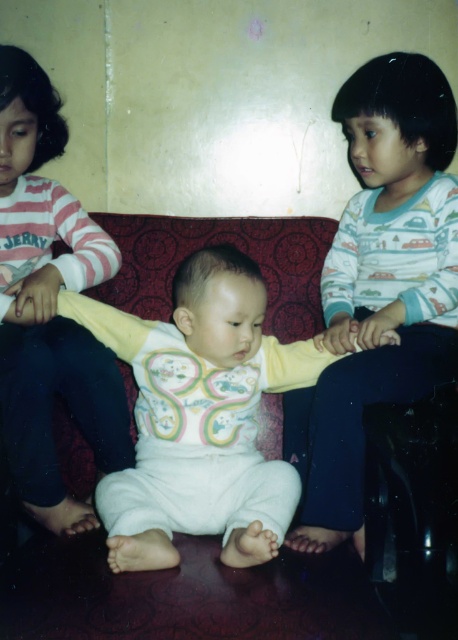
Looking at the three children on the red patterned couch, you notice the white soft onesie at center and the white soft baby at center. Which object is wider?

The white soft onesie at center is wider than the white soft baby at center.

Based on the scene description, which child is wearing clothing with greater height between the white cotton shirt at right and the white soft onesie at center?

The white cotton shirt at right has a greater height compared to the white soft onesie at center.